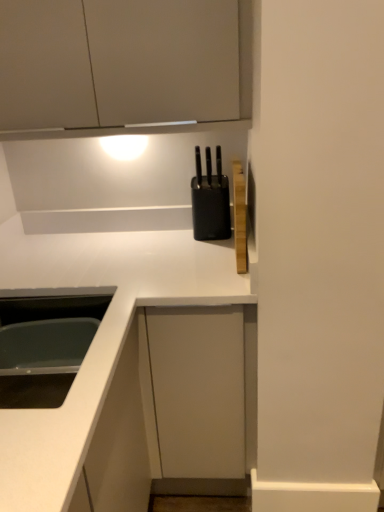
Question: Can we say white glossy sink at lower left lies outside black plastic knife block at upper center?

Choices:
 (A) yes
 (B) no

Answer: (A)

Question: Would you consider white glossy sink at lower left to be distant from black plastic knife block at upper center?

Choices:
 (A) yes
 (B) no

Answer: (B)

Question: From the image's perspective, is white glossy sink at lower left over black plastic knife block at upper center?

Choices:
 (A) no
 (B) yes

Answer: (A)

Question: Considering the relative sizes of white glossy sink at lower left and black plastic knife block at upper center in the image provided, is white glossy sink at lower left wider than black plastic knife block at upper center?

Choices:
 (A) no
 (B) yes

Answer: (B)

Question: Does white glossy sink at lower left turn towards black plastic knife block at upper center?

Choices:
 (A) yes
 (B) no

Answer: (B)

Question: From a real-world perspective, is white glossy countertop at center physically located above or below matte gray cabinet at upper left?

Choices:
 (A) below
 (B) above

Answer: (A)

Question: Looking at their shapes, would you say white glossy countertop at center is wider or thinner than matte gray cabinet at upper left?

Choices:
 (A) thin
 (B) wide

Answer: (B)

Question: In the image, is white glossy countertop at center on the left side or the right side of matte gray cabinet at upper left?

Choices:
 (A) left
 (B) right

Answer: (B)

Question: Considering the positions of white glossy countertop at center and matte gray cabinet at upper left in the image, is white glossy countertop at center bigger or smaller than matte gray cabinet at upper left?

Choices:
 (A) big
 (B) small

Answer: (A)

Question: Is white glossy sink at lower left spatially inside matte gray cabinet at upper left, or outside of it?

Choices:
 (A) outside
 (B) inside

Answer: (A)

Question: In terms of width, does white glossy sink at lower left look wider or thinner when compared to matte gray cabinet at upper left?

Choices:
 (A) thin
 (B) wide

Answer: (B)

Question: From a real-world perspective, is white glossy sink at lower left physically located above or below matte gray cabinet at upper left?

Choices:
 (A) above
 (B) below

Answer: (B)

Question: Considering the relative positions of white glossy sink at lower left and matte gray cabinet at upper left in the image provided, is white glossy sink at lower left to the left or to the right of matte gray cabinet at upper left?

Choices:
 (A) left
 (B) right

Answer: (A)

Question: From the image's perspective, is matte gray cabinet at upper left above or below black plastic knife block at upper center?

Choices:
 (A) above
 (B) below

Answer: (A)

Question: Considering the positions of matte gray cabinet at upper left and black plastic knife block at upper center in the image, is matte gray cabinet at upper left bigger or smaller than black plastic knife block at upper center?

Choices:
 (A) big
 (B) small

Answer: (A)